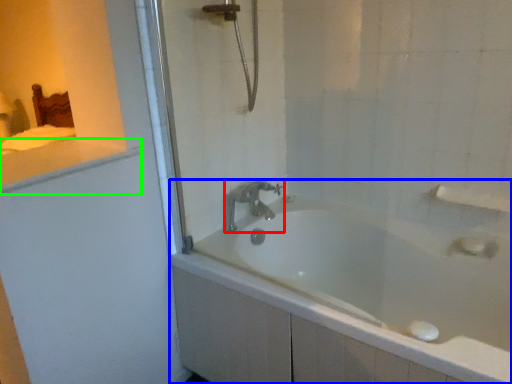
Question: Which object is the closest to the tap (highlighted by a red box)? Choose among these: bathtub (highlighted by a blue box) or counter top (highlighted by a green box).

Choices:
 (A) bathtub
 (B) counter top

Answer: (A)